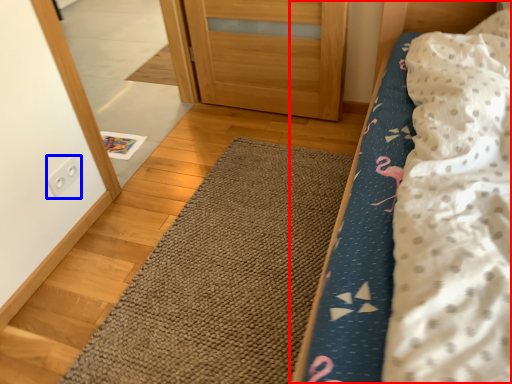
Question: Which of the following is the farthest to the observer, bed (highlighted by a red box) or electric outlet (highlighted by a blue box)?

Choices:
 (A) bed
 (B) electric outlet

Answer: (B)